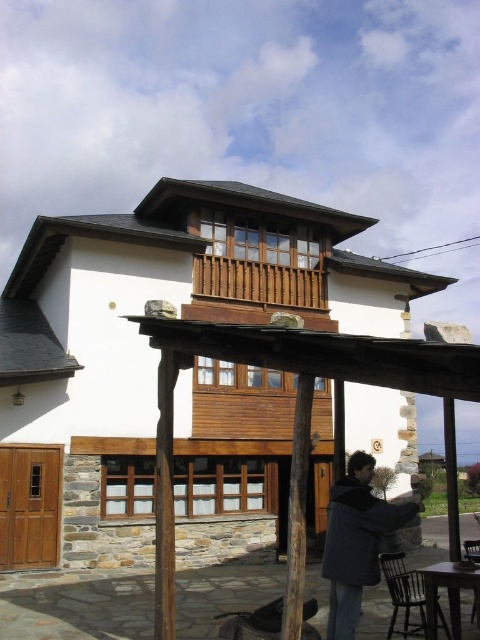
Question: Observing the image, what is the correct spatial positioning of wooden pergola at center in reference to dark gray jacket at center?

Choices:
 (A) left
 (B) right

Answer: (A)

Question: Which object is positioned closest to the dark gray jacket at center?

Choices:
 (A) wooden at upper center
 (B) wooden pergola at center

Answer: (B)

Question: Is wooden pergola at center closer to the viewer compared to dark gray jacket at center?

Choices:
 (A) yes
 (B) no

Answer: (A)

Question: Which of the following is the farthest from the observer?

Choices:
 (A) (349, 252)
 (B) (332, 557)

Answer: (A)

Question: Is wooden pergola at center behind wooden at upper center?

Choices:
 (A) no
 (B) yes

Answer: (A)

Question: Which of the following is the farthest from the observer?

Choices:
 (A) wooden at upper center
 (B) dark gray jacket at center
 (C) wooden pergola at center

Answer: (A)